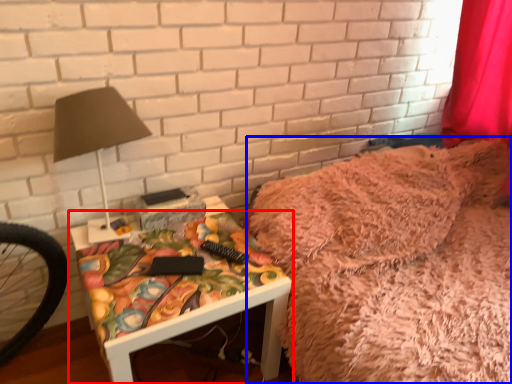
Question: Among these objects, which one is nearest to the camera, furniture (highlighted by a red box) or bed (highlighted by a blue box)?

Choices:
 (A) furniture
 (B) bed

Answer: (A)